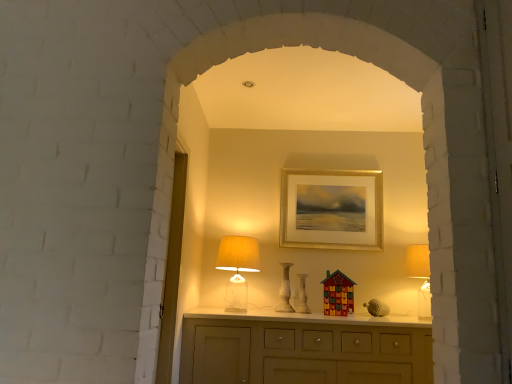
Question: Is white marble vase at center, which is the first vase in left-to-right order, turned away from white marble vase at center, which ranks as the second vase in left-to-right order?

Choices:
 (A) yes
 (B) no

Answer: (B)

Question: Is white marble vase at center, arranged as the 2th vase when viewed from the right, in front of white marble vase at center, which ranks as the second vase in left-to-right order?

Choices:
 (A) no
 (B) yes

Answer: (A)

Question: Is white marble vase at center, arranged as the 2th vase when viewed from the right, oriented towards white marble vase at center, the 1th vase viewed from the right?

Choices:
 (A) yes
 (B) no

Answer: (B)

Question: Is white marble vase at center, which is the first vase in left-to-right order, not within white marble vase at center, the 1th vase viewed from the right?

Choices:
 (A) yes
 (B) no

Answer: (A)

Question: Is there a large distance between white marble vase at center, which is the first vase in left-to-right order, and white marble vase at center, the 1th vase viewed from the right?

Choices:
 (A) yes
 (B) no

Answer: (B)

Question: Can you confirm if white marble vase at center, which is the first vase in left-to-right order, is shorter than white marble vase at center, which ranks as the second vase in left-to-right order?

Choices:
 (A) yes
 (B) no

Answer: (B)

Question: Does translucent glass table lamp at center appear on the right side of white marble vase at center, which ranks as the second vase in left-to-right order?

Choices:
 (A) yes
 (B) no

Answer: (B)

Question: Does translucent glass table lamp at center have a lesser width compared to white marble vase at center, the 1th vase viewed from the right?

Choices:
 (A) no
 (B) yes

Answer: (A)

Question: Is translucent glass table lamp at center far from white marble vase at center, which ranks as the second vase in left-to-right order?

Choices:
 (A) yes
 (B) no

Answer: (B)

Question: Is translucent glass table lamp at center not within white marble vase at center, the 1th vase viewed from the right?

Choices:
 (A) no
 (B) yes

Answer: (B)

Question: From a real-world perspective, is translucent glass table lamp at center physically below white marble vase at center, which ranks as the second vase in left-to-right order?

Choices:
 (A) yes
 (B) no

Answer: (B)

Question: Is translucent glass table lamp at center wider than white marble vase at center, which ranks as the second vase in left-to-right order?

Choices:
 (A) no
 (B) yes

Answer: (B)

Question: Is transparent glass door at left taller than translucent glass table lamp at center?

Choices:
 (A) no
 (B) yes

Answer: (B)